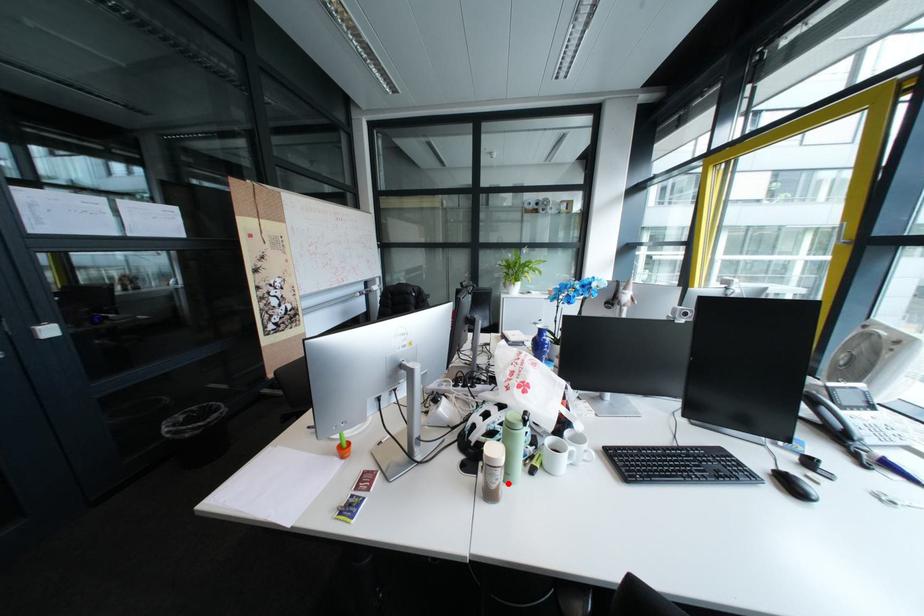
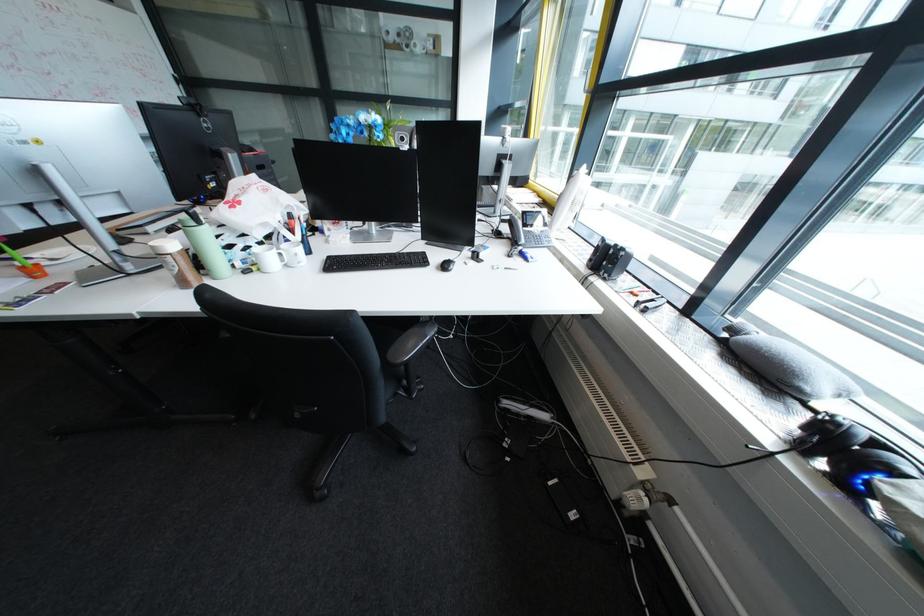
Find the pixel in the second image that matches the highlighted location in the first image.

(187, 270)